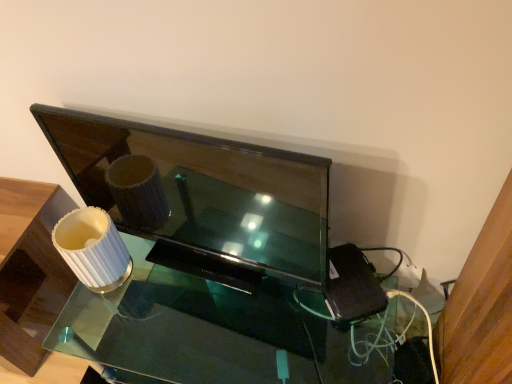
You are a GUI agent. You are given a task and a screenshot of the screen. Output one action in this format:
    pyautogui.click(x=<x>, y=<y>)
    Task: Click on the clear glass table at center
    
    Given the screenshot: What is the action you would take?
    pyautogui.click(x=206, y=332)

Locate an element on the screen. The width and height of the screenshot is (512, 384). white ribbed lampshade at left is located at coordinates (30, 269).

What is the approximate height of white ribbed lampshade at left?

It is 50.98 centimeters.

I want to click on matte black tv at center, so click(200, 190).

From a real-world perspective, is clear glass table at center beneath matte black tv at center?

Yes, from a real-world perspective, clear glass table at center is beneath matte black tv at center.

Considering the sizes of objects clear glass table at center and matte black tv at center in the image provided, who is taller, clear glass table at center or matte black tv at center?

Standing taller between the two is matte black tv at center.

Which object is thinner, clear glass table at center or matte black tv at center?

Thinner between the two is matte black tv at center.

Is clear glass table at center aimed at matte black tv at center?

No.

Is white ribbed lampshade at left far away from matte black tv at center?

No, white ribbed lampshade at left is not far from matte black tv at center.

Considering the positions of objects white ribbed lampshade at left and matte black tv at center in the image provided, who is more to the left, white ribbed lampshade at left or matte black tv at center?

From the viewer's perspective, white ribbed lampshade at left appears more on the left side.

Could you tell me if white ribbed lampshade at left is turned towards matte black tv at center?

No, white ribbed lampshade at left does not turn towards matte black tv at center.

From a real-world perspective, which is physically above, matte black tv at center or clear glass table at center?

matte black tv at center, from a real-world perspective.

Can you tell me how much matte black tv at center and clear glass table at center differ in facing direction?

matte black tv at center and clear glass table at center are facing 9.82 degrees away from each other.

Relative to clear glass table at center, is matte black tv at center in front or behind?

matte black tv at center is positioned closer to the viewer than clear glass table at center.

Considering the relative sizes of matte black tv at center and clear glass table at center in the image provided, is matte black tv at center bigger than clear glass table at center?

Actually, matte black tv at center might be smaller than clear glass table at center.

Would you say white ribbed lampshade at left is to the left or to the right of clear glass table at center in the picture?

In the image, white ribbed lampshade at left appears on the left side of clear glass table at center.

Based on the photo, is white ribbed lampshade at left positioned beyond the bounds of clear glass table at center?

That's correct, white ribbed lampshade at left is outside of clear glass table at center.

Consider the image. Relative to clear glass table at center, is white ribbed lampshade at left in front or behind?

white ribbed lampshade at left is positioned farther from the viewer than clear glass table at center.

Is white ribbed lampshade at left facing away from clear glass table at center?

No, white ribbed lampshade at left is not facing away from clear glass table at center.

At what (x,y) coordinates should I click in order to perform the action: click on television above the white ribbed lampshade at left (from the image's perspective). Please return your answer as a coordinate pair (x, y). The image size is (512, 384). Looking at the image, I should click on (200, 190).

Which of these two, matte black tv at center or white ribbed lampshade at left, is wider?

white ribbed lampshade at left is wider.

Is point (44, 123) positioned before point (13, 282)?

Yes, point (44, 123) is in front of point (13, 282).

Considering the sizes of matte black tv at center and white ribbed lampshade at left in the image, is matte black tv at center taller or shorter than white ribbed lampshade at left?

Clearly, matte black tv at center is shorter compared to white ribbed lampshade at left.

Would you say clear glass table at center is outside white ribbed lampshade at left?

Yes.

Measure the distance from clear glass table at center to white ribbed lampshade at left.

The distance of clear glass table at center from white ribbed lampshade at left is 16.33 inches.

Consider the image. Is clear glass table at center in contact with white ribbed lampshade at left?

clear glass table at center and white ribbed lampshade at left are clearly separated.

Could you tell me if clear glass table at center is turned towards white ribbed lampshade at left?

No, clear glass table at center is not oriented towards white ribbed lampshade at left.

This screenshot has width=512, height=384. Find the location of `table located on the right of matte black tv at center`. table located on the right of matte black tv at center is located at coordinates click(206, 332).

You are a GUI agent. You are given a task and a screenshot of the screen. Output one action in this format:
    pyautogui.click(x=<x>, y=<y>)
    Task: Click on the television above the white ribbed lampshade at left (from the image's perspective)
    
    Given the screenshot: What is the action you would take?
    pyautogui.click(x=200, y=190)

Based on their spatial positions, is white ribbed lampshade at left or matte black tv at center closer to clear glass table at center?

The object closer to clear glass table at center is matte black tv at center.

Considering their positions, is clear glass table at center positioned closer to white ribbed lampshade at left than matte black tv at center?

Based on the image, clear glass table at center appears to be nearer to white ribbed lampshade at left.

Based on their spatial positions, is clear glass table at center or white ribbed lampshade at left closer to matte black tv at center?

The object closer to matte black tv at center is clear glass table at center.

Considering their positions, is matte black tv at center positioned further to clear glass table at center than white ribbed lampshade at left?

Based on the image, white ribbed lampshade at left appears to be further to clear glass table at center.

From the image, which object appears to be farther from white ribbed lampshade at left, matte black tv at center or clear glass table at center?

matte black tv at center is positioned further to the anchor white ribbed lampshade at left.

Based on their spatial positions, is white ribbed lampshade at left or clear glass table at center closer to matte black tv at center?

Result: Among the two, clear glass table at center is located nearer to matte black tv at center.

Where is `television situated between white ribbed lampshade at left and clear glass table at center from left to right`? television situated between white ribbed lampshade at left and clear glass table at center from left to right is located at coordinates (200, 190).